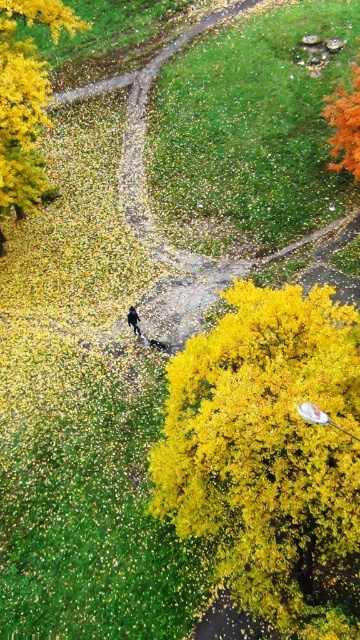
Between golden textured bush at lower right and dark blue fabric at center, which one is positioned lower?

golden textured bush at lower right is below.

Is golden textured bush at lower right taller than dark blue fabric at center?

Yes.

The height and width of the screenshot is (640, 360). What are the coordinates of `golden textured bush at lower right` in the screenshot? It's located at (267, 449).

Who is positioned more to the left, golden textured leaves at upper left or dark blue fabric at center?

golden textured leaves at upper left is more to the left.

Does golden textured leaves at upper left appear on the left side of dark blue fabric at center?

Indeed, golden textured leaves at upper left is positioned on the left side of dark blue fabric at center.

Identify the location of golden textured leaves at upper left. (25, 97).

You are a GUI agent. You are given a task and a screenshot of the screen. Output one action in this format:
    pyautogui.click(x=<x>, y=<y>)
    Task: Click on the golden textured leaves at upper left
    The image size is (360, 640).
    Given the screenshot: What is the action you would take?
    pyautogui.click(x=25, y=97)

Is golden textured bush at lower right wider than golden textured leaves at upper left?

Yes.

Is golden textured bush at lower right to the right of golden textured leaves at upper left from the viewer's perspective?

Yes, golden textured bush at lower right is to the right of golden textured leaves at upper left.

Between point (174, 497) and point (7, 134), which one is positioned in front?

Point (174, 497) is in front.

You are a GUI agent. You are given a task and a screenshot of the screen. Output one action in this format:
    pyautogui.click(x=<x>, y=<y>)
    Task: Click on the golden textured bush at lower right
    
    Given the screenshot: What is the action you would take?
    pyautogui.click(x=267, y=449)